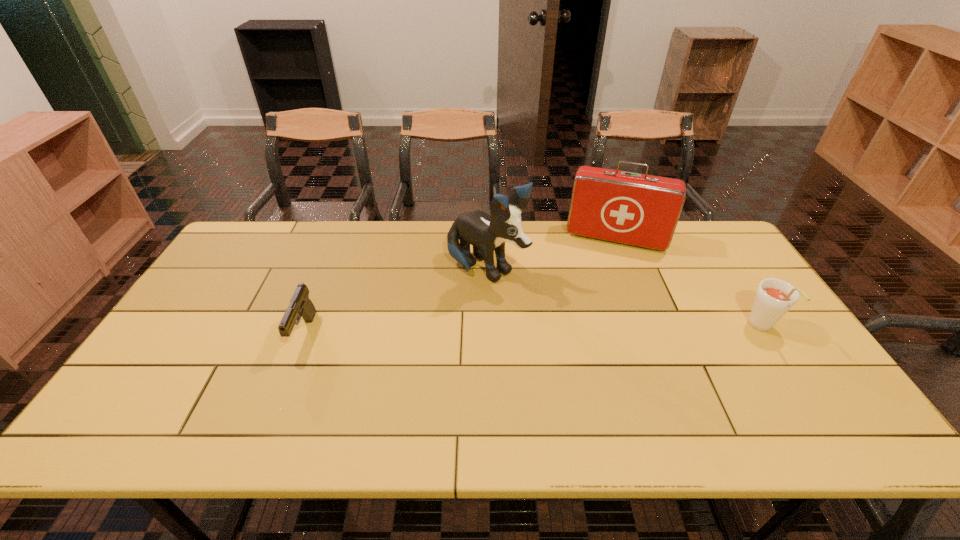
This screenshot has height=540, width=960. In order to click on empty location between the rightmost object and the puppy in this screenshot , I will do `click(624, 299)`.

Where is `empty location between the root beer and the second object from right to left`? empty location between the root beer and the second object from right to left is located at coordinates (689, 284).

Find the location of a particular element. Image resolution: width=960 pixels, height=540 pixels. empty space that is in between the pistol and the tallest object is located at coordinates (396, 302).

Identify the location of vacant point located between the puppy and the pistol. (396, 302).

Image resolution: width=960 pixels, height=540 pixels. In order to click on free spot between the shortest object and the tallest object in this screenshot , I will do `click(396, 302)`.

Where is `free spot between the pistol and the second object from right to left`? The image size is (960, 540). free spot between the pistol and the second object from right to left is located at coordinates (460, 286).

Where is `object that can be found as the second closest to the second object from left to right`? This screenshot has width=960, height=540. object that can be found as the second closest to the second object from left to right is located at coordinates (300, 305).

I want to click on object that is the third nearest to the second tallest object, so (x=300, y=305).